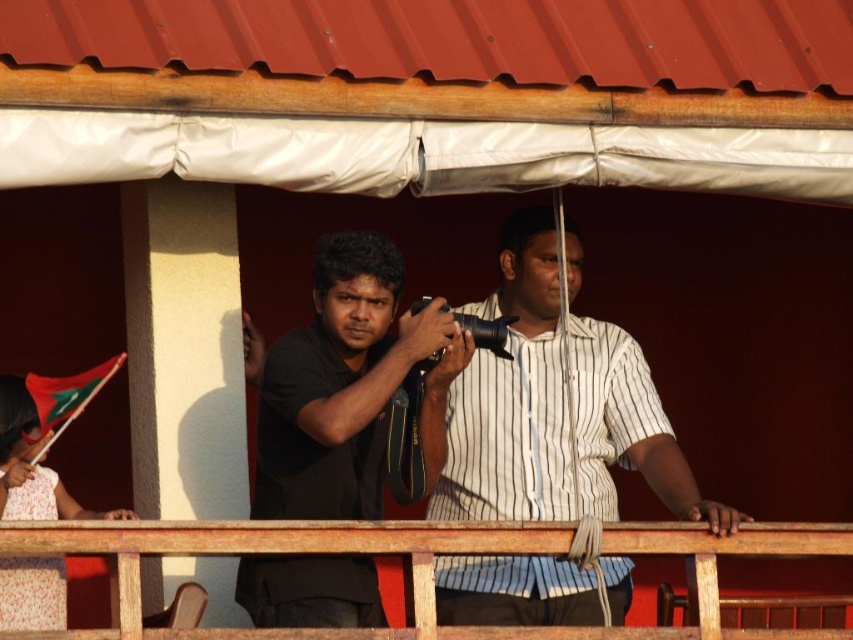
You are standing on the balcony and want to hand a tool to the person wearing the white striped shirt at center and the person near the wooden at center. Which person will require you to reach further to hand the tool?

The wooden at center is further away from you than the white striped shirt at center, so handing the tool to the person near the wooden at center will require reaching further.